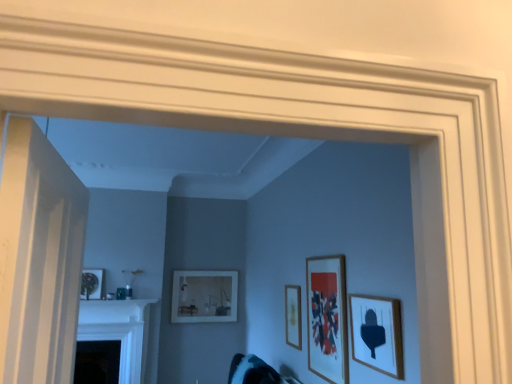
Question: Considering the positions of black glossy fireplace at lower left and matte wooden picture frame at center, the third picture frame from the left, in the image, is black glossy fireplace at lower left taller or shorter than matte wooden picture frame at center, the third picture frame from the left,?

Choices:
 (A) short
 (B) tall

Answer: (B)

Question: Looking at their shapes, would you say black glossy fireplace at lower left is wider or thinner than matte wooden picture frame at center, which appears as the second picture frame when viewed from the front?

Choices:
 (A) wide
 (B) thin

Answer: (A)

Question: Based on their relative distances, which object is nearer to the wooden picture frame at right, the 1th picture frame when ordered from front to back?

Choices:
 (A) teal fabric swivel chair at lower center
 (B) wooden picture frame at center, which is the 2th picture frame in left-to-right order
 (C) white wooden door at left
 (D) matte white picture frame at center, which is the first picture frame from left to right
 (E) black glossy fireplace at lower left

Answer: (B)

Question: Which object is the closest to the matte white picture frame at center, which is the first picture frame from left to right?

Choices:
 (A) white wooden door at left
 (B) wooden picture frame at right, which is the 4th picture frame from back to front
 (C) black glossy fireplace at lower left
 (D) matte wooden picture frame at center, arranged as the 3th picture frame when viewed from the back
 (E) wooden picture frame at center, the 2th picture frame when ordered from back to front

Answer: (C)